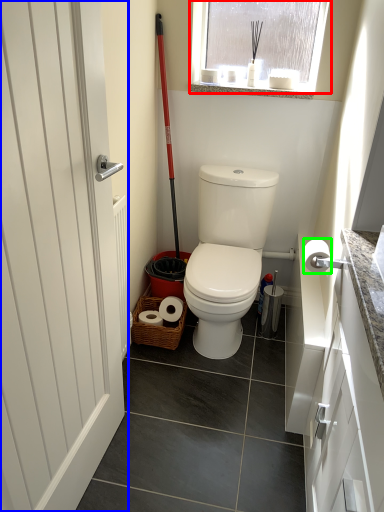
Question: Considering the real-world distances, which object is closest to window (highlighted by a red box)? door (highlighted by a blue box) or toilet paper (highlighted by a green box).

Choices:
 (A) door
 (B) toilet paper

Answer: (B)